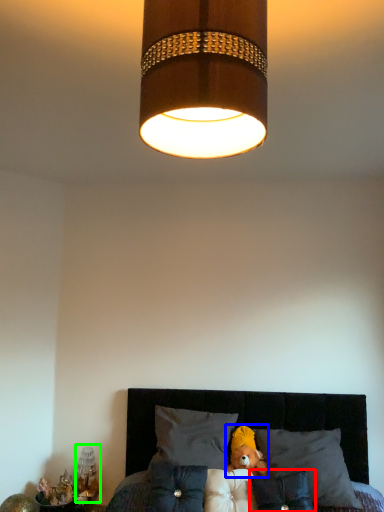
Question: Which is nearer to the pillow (highlighted by a red box)? teddy (highlighted by a blue box) or bedside lamp (highlighted by a green box).

Choices:
 (A) teddy
 (B) bedside lamp

Answer: (A)